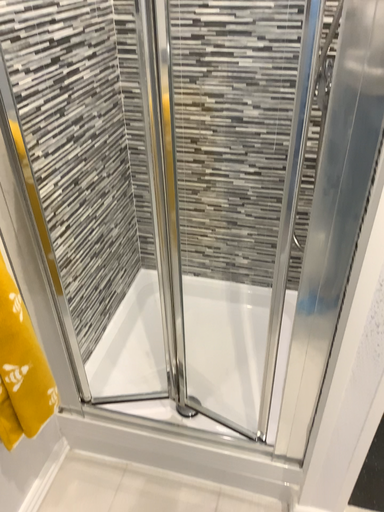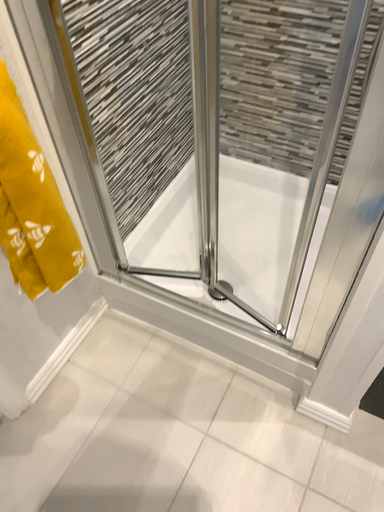
Question: Which way did the camera rotate in the video?

Choices:
 (A) rotated left
 (B) rotated right

Answer: (A)